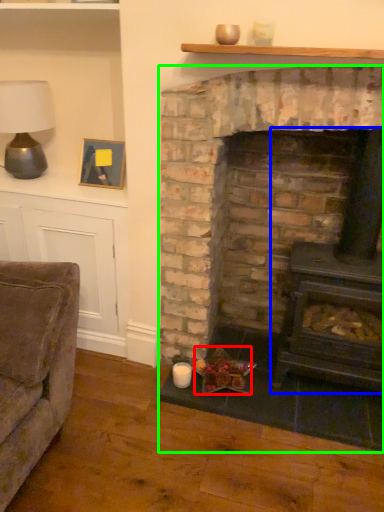
Question: Which object is the closest to the food (highlighted by a red box)? Choose among these: wood burning stove (highlighted by a blue box) or fireplace (highlighted by a green box).

Choices:
 (A) wood burning stove
 (B) fireplace

Answer: (B)